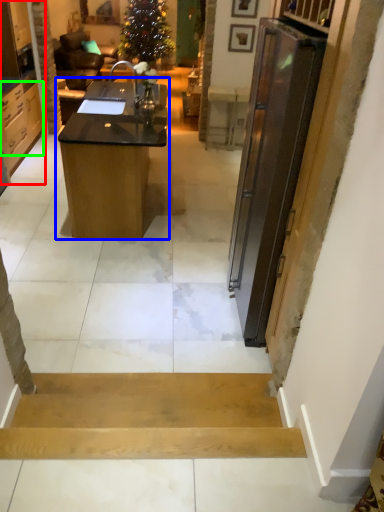
Question: Estimate the real-world distances between objects in this image. Which object is closer to cabinetry (highlighted by a red box), desk (highlighted by a blue box) or cabinetry (highlighted by a green box)?

Choices:
 (A) desk
 (B) cabinetry

Answer: (B)